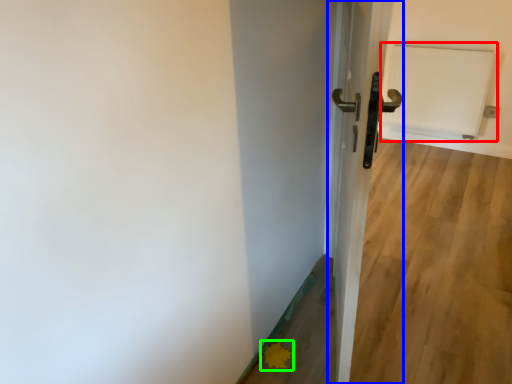
Question: Estimate the real-world distances between objects in this image. Which object is farther from radiator (highlighted by a red box), door (highlighted by a blue box) or flower (highlighted by a green box)?

Choices:
 (A) door
 (B) flower

Answer: (B)